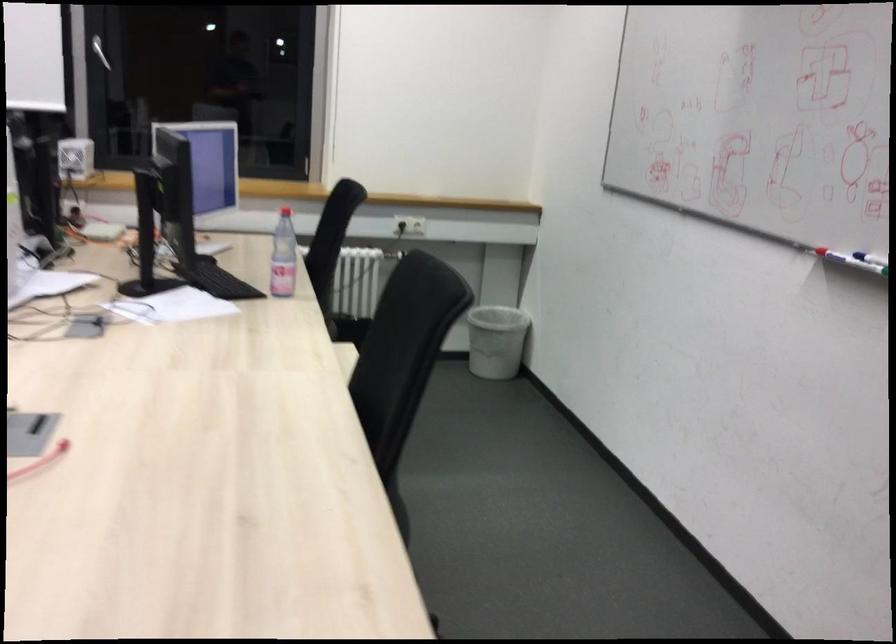
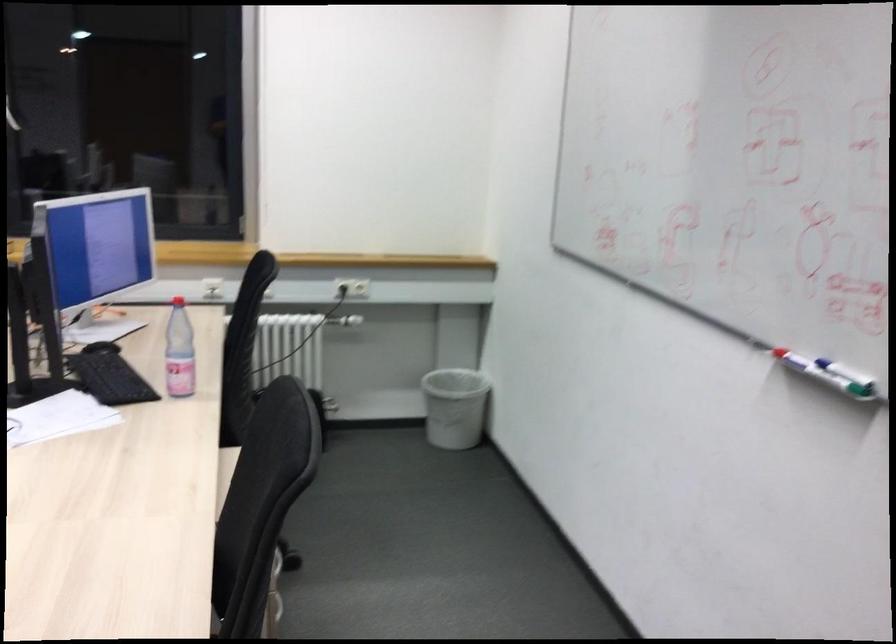
Locate, in the second image, the point that corresponds to point 410,225 in the first image.

(352, 287)